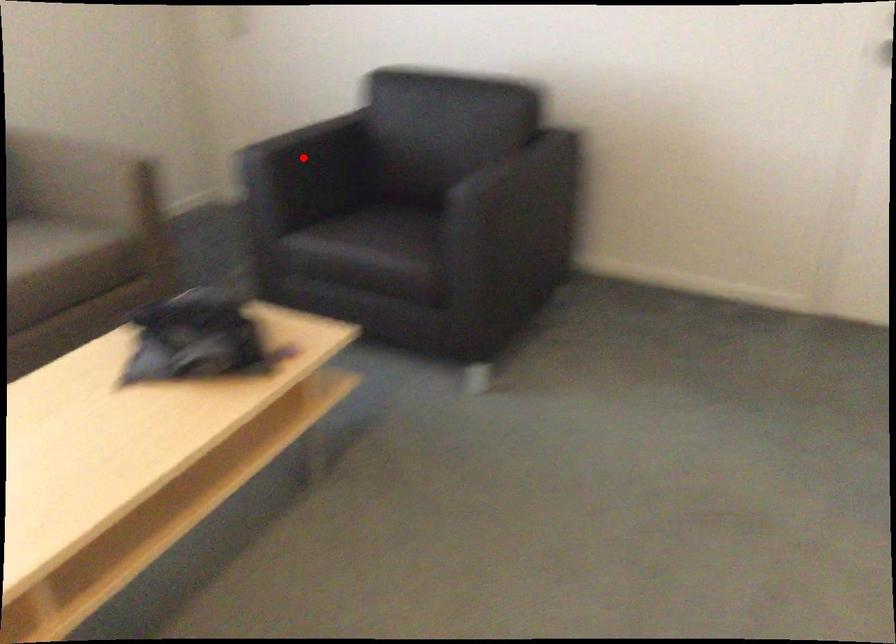
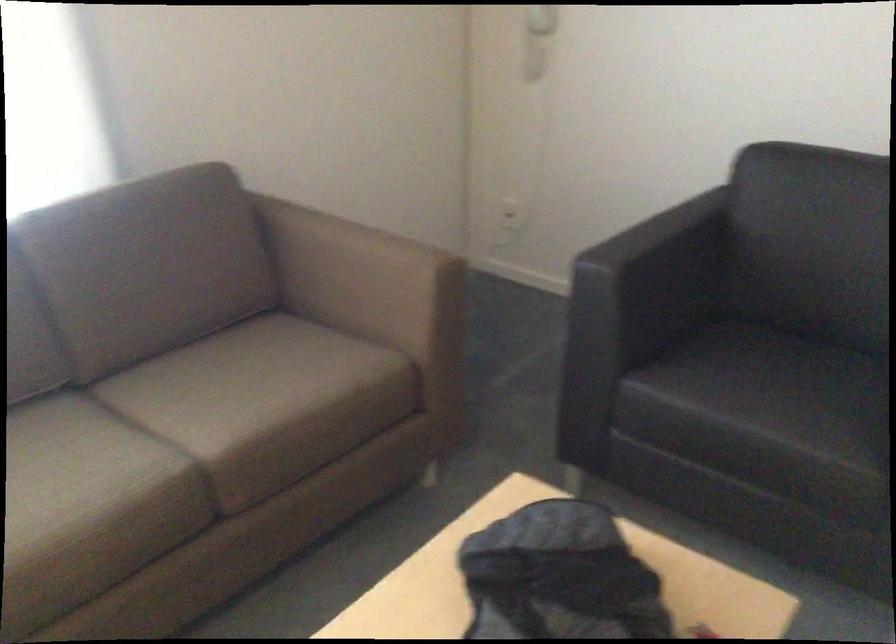
Question: I am providing you with two images of the same scene from different viewpoints. Image1 has a red point marked. In image2, the corresponding 3D location appears at what relative position? Reply with the corresponding letter.

Choices:
 (A) Closer
 (B) Farther

Answer: (A)